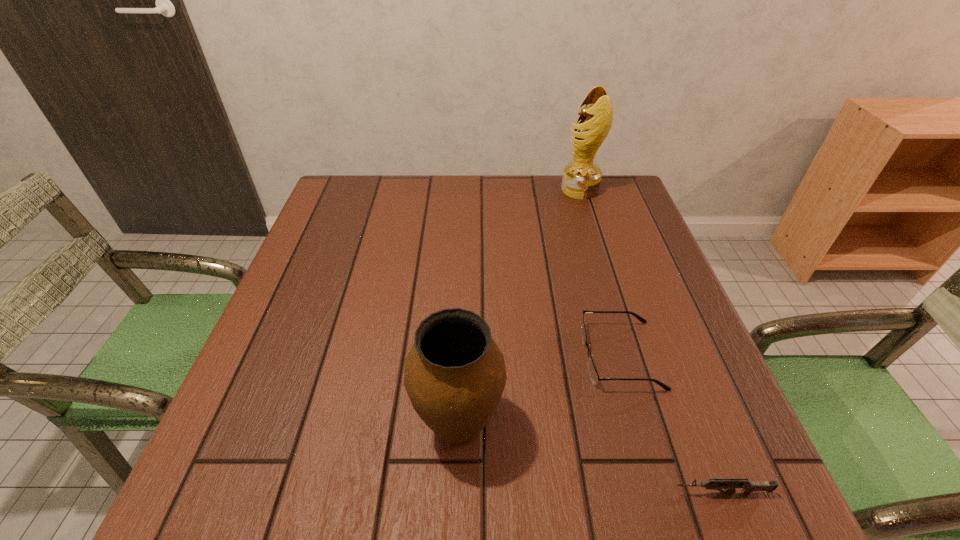
Locate an element on the screen. Image resolution: width=960 pixels, height=540 pixels. the farthest object is located at coordinates (581, 179).

You are a GUI agent. You are given a task and a screenshot of the screen. Output one action in this format:
    pyautogui.click(x=<x>, y=<y>)
    Task: Click on the tallest object
    
    Given the screenshot: What is the action you would take?
    pyautogui.click(x=581, y=179)

You are a GUI agent. You are given a task and a screenshot of the screen. Output one action in this format:
    pyautogui.click(x=<x>, y=<y>)
    Task: Click on the third shortest object
    This screenshot has height=540, width=960.
    Given the screenshot: What is the action you would take?
    pyautogui.click(x=455, y=374)

Where is `the leftmost object`? Image resolution: width=960 pixels, height=540 pixels. the leftmost object is located at coordinates (455, 374).

Find the location of a particular element. gun is located at coordinates (748, 486).

Locate an element on the screen. This screenshot has height=540, width=960. spectacles is located at coordinates click(x=593, y=373).

Image resolution: width=960 pixels, height=540 pixels. What are the coordinates of `free space located 0.270m on the front-facing side of the farthest object` in the screenshot? It's located at (470, 190).

This screenshot has height=540, width=960. I want to click on vacant region located 0.240m on the front-facing side of the farthest object, so click(481, 190).

Locate an element on the screen. The height and width of the screenshot is (540, 960). vacant space located on the front-facing side of the farthest object is located at coordinates (450, 190).

In order to click on free space located 0.220m on the back of the urn in this screenshot , I will do `click(464, 302)`.